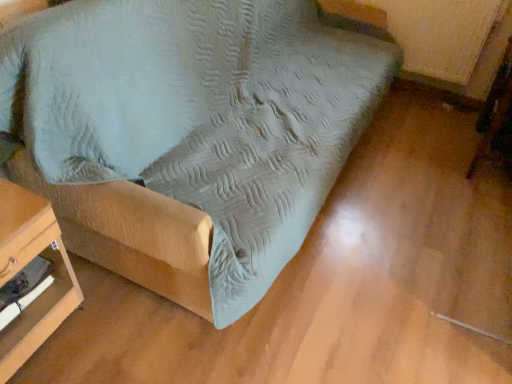
Where is `vacant space behind wooden swivel chair at lower right`? The height and width of the screenshot is (384, 512). vacant space behind wooden swivel chair at lower right is located at coordinates [x=443, y=119].